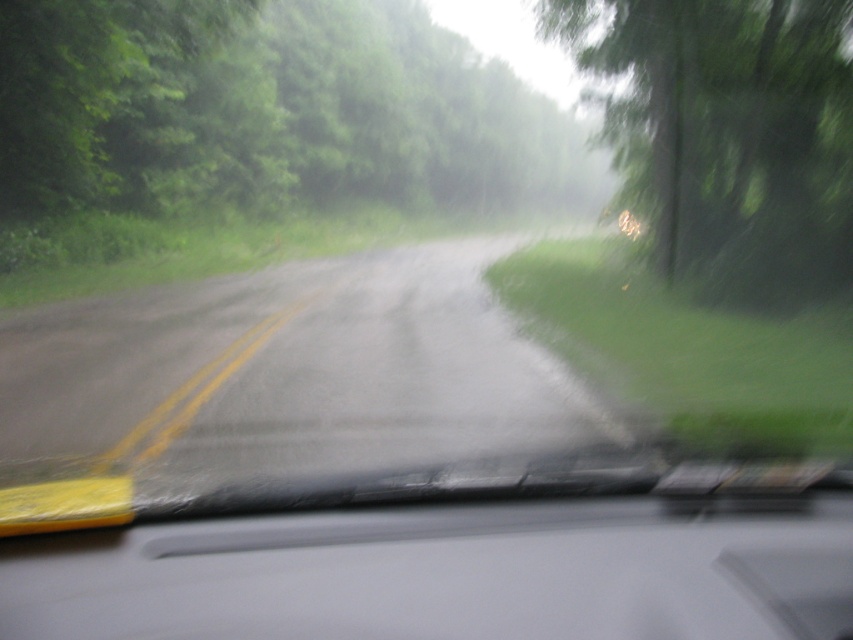
From the picture: You are a passenger in a car driving on this road. You notice two trees outside the window. The green leafy tree at upper left and the green matte tree at right. Which tree is closer to the car?

The green leafy tree at upper left is closer to the car because it is in front of the green matte tree at right.